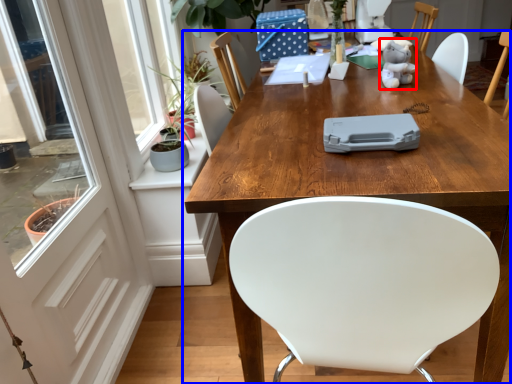
Question: Which object appears closest to the camera in this image, toy (highlighted by a red box) or table (highlighted by a blue box)?

Choices:
 (A) toy
 (B) table

Answer: (B)